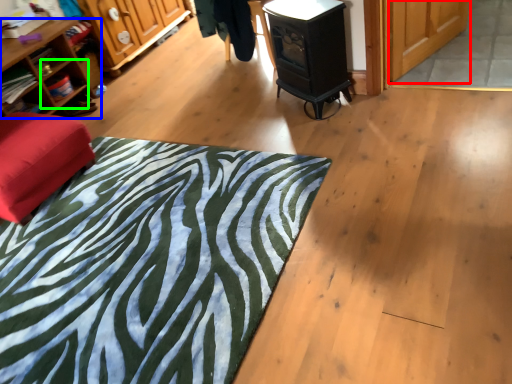
Question: Based on their relative distances, which object is farther from screen door (highlighted by a red box)? Choose from shelf (highlighted by a blue box) and shelf (highlighted by a green box).

Choices:
 (A) shelf
 (B) shelf

Answer: (B)